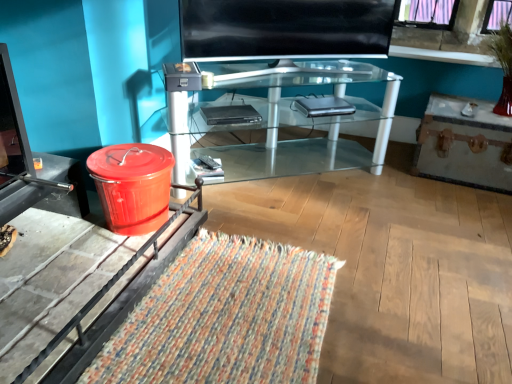
Question: From a real-world perspective, is clear glass desk at center physically located above or below black plastic dvd player at center, positioned as the second laptop in right-to-left order?

Choices:
 (A) below
 (B) above

Answer: (A)

Question: From the image's perspective, is clear glass desk at center located above or below black plastic dvd player at center, which appears as the first laptop when viewed from the front?

Choices:
 (A) below
 (B) above

Answer: (B)

Question: Estimate the real-world distances between objects in this image. Which object is closer to the shiny plastic trash can at lower left?

Choices:
 (A) black plastic remote control at center
 (B) shiny red vase at upper right
 (C) black glass screen at center
 (D) clear glass desk at center
 (E) black plastic dvd player at center, which appears as the first laptop when viewed from the front

Answer: (E)

Question: Estimate the real-world distances between objects in this image. Which object is farther from the clear glass desk at center?

Choices:
 (A) metallic silver drawer at right
 (B) shiny red vase at upper right
 (C) woven multicolored mat at lower left
 (D) black glass screen at center
 (E) black plastic remote control at center

Answer: (B)